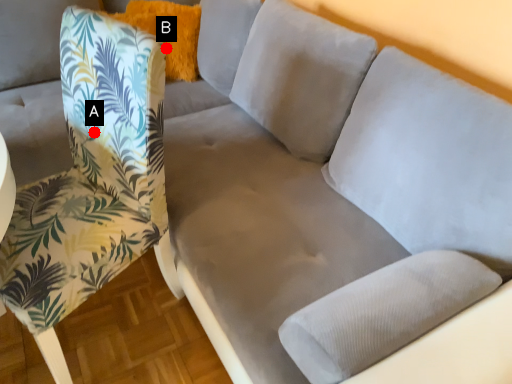
Question: Two points are circled on the image, labeled by A and B beside each circle. Which point is closer to the camera taking this photo?

Choices:
 (A) A is closer
 (B) B is closer

Answer: (A)